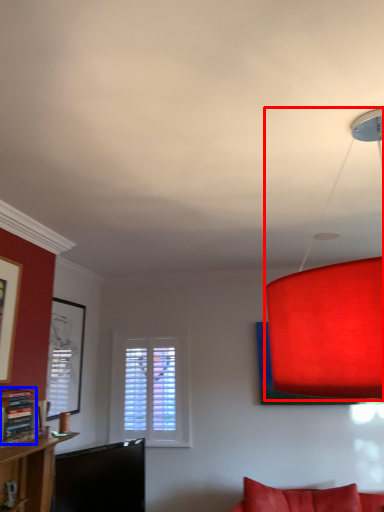
Question: Which object appears closest to the camera in this image, lamp (highlighted by a red box) or shelf (highlighted by a blue box)?

Choices:
 (A) lamp
 (B) shelf

Answer: (A)